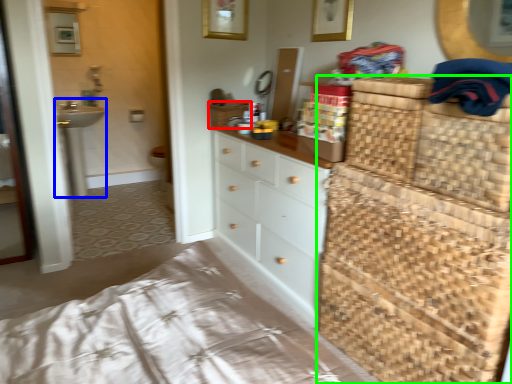
Question: Which object is the farthest from basket (highlighted by a red box)? Choose among these: sink (highlighted by a blue box) or dresser (highlighted by a green box).

Choices:
 (A) sink
 (B) dresser

Answer: (A)